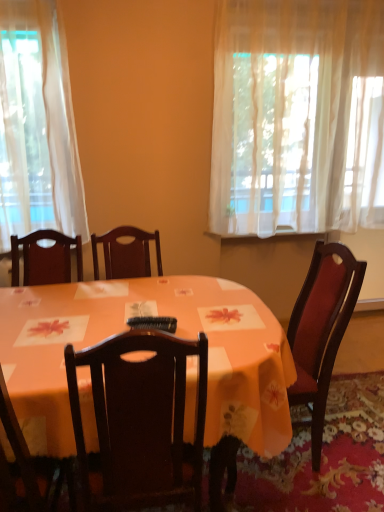
Where is `blank space above orange fabric table at center (from a real-world perspective)`? The image size is (384, 512). blank space above orange fabric table at center (from a real-world perspective) is located at coordinates (167, 302).